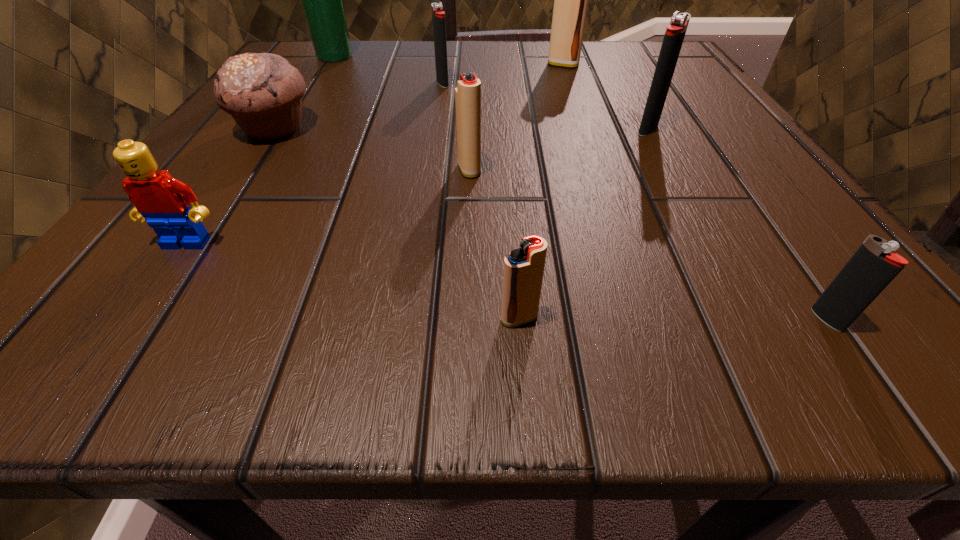
Locate an element on the screen. This screenshot has width=960, height=540. red Lego is located at coordinates (162, 200).

What are the coordinates of `the seventh farthest object` in the screenshot? It's located at (162, 200).

Locate an element on the screen. The width and height of the screenshot is (960, 540). muffin is located at coordinates click(263, 92).

Where is `the nearest red igniter`? This screenshot has height=540, width=960. the nearest red igniter is located at coordinates (523, 272).

Find the location of a particular element. the sixth object from left to right is located at coordinates (523, 272).

Find the location of a particular element. Image resolution: width=960 pixels, height=540 pixels. the nearest black igniter is located at coordinates (868, 272).

You are a GUI agent. You are given a task and a screenshot of the screen. Output one action in this format:
    pyautogui.click(x=<x>, y=<y>)
    Task: Click on the rightmost igniter
    
    Given the screenshot: What is the action you would take?
    pyautogui.click(x=868, y=272)

Image resolution: width=960 pixels, height=540 pixels. I want to click on free space located 0.330m on the right of the tallest object, so click(x=531, y=56).

Identify the location of vacant space located 0.320m on the left of the third igniter from right to left. (370, 65).

Identify the location of free space located on the left of the fifth igniter from left to right. (474, 129).